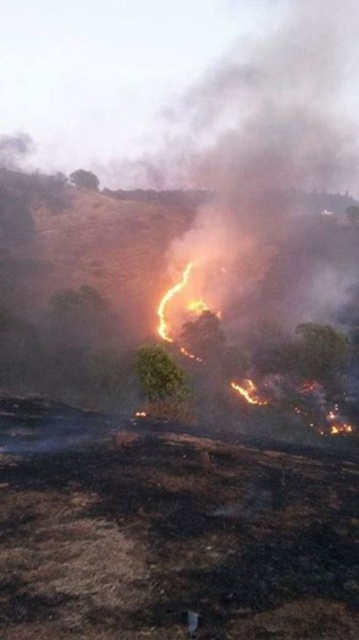
Question: Which object appears farthest from the camera in this image?

Choices:
 (A) charcoal ash hillside at center
 (B) green leafy tree at upper center

Answer: (B)

Question: Can you confirm if green leafy tree at center is positioned above green leafy tree at upper center?

Choices:
 (A) no
 (B) yes

Answer: (A)

Question: Among these points, which one is farthest from the camera?

Choices:
 (A) (347, 429)
 (B) (145, 410)

Answer: (A)

Question: Which point is closer to the camera?

Choices:
 (A) click(268, 276)
 (B) click(154, 403)

Answer: (B)

Question: Is charcoal ash hillside at center further to the viewer compared to green leafy tree at center?

Choices:
 (A) yes
 (B) no

Answer: (A)

Question: Is charcoal ash hillside at center positioned in front of green leafy tree at center?

Choices:
 (A) no
 (B) yes

Answer: (A)